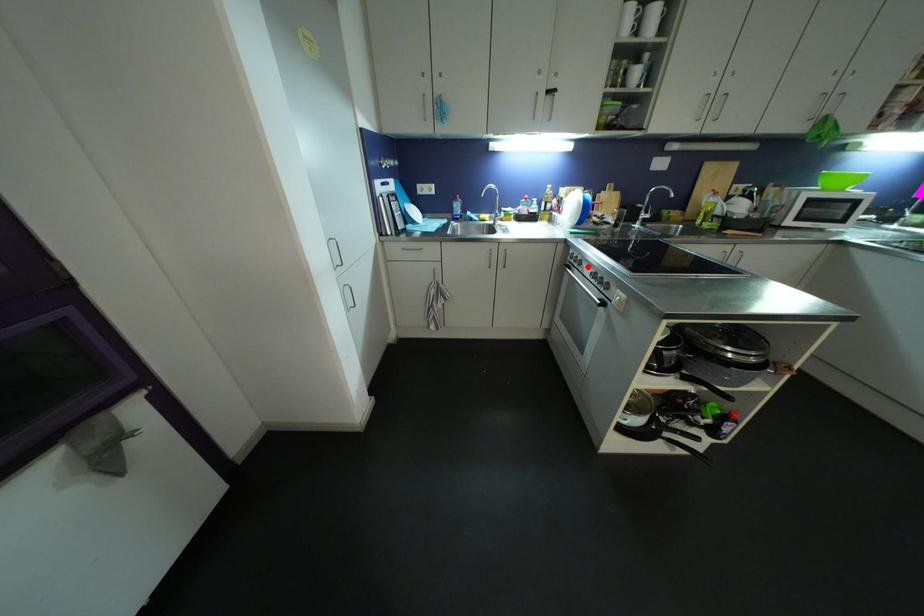
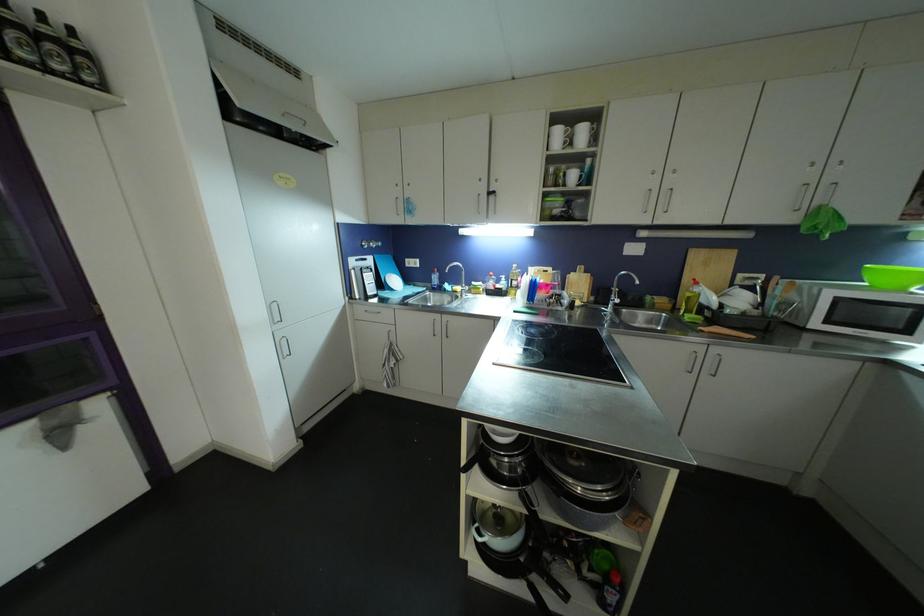
Question: I am providing you with two images of the same scene from different viewpoints. A red point is marked on the first image. At the location where the point appears in image 1, is it still visible in image 2?

Choices:
 (A) Yes
 (B) No

Answer: (B)